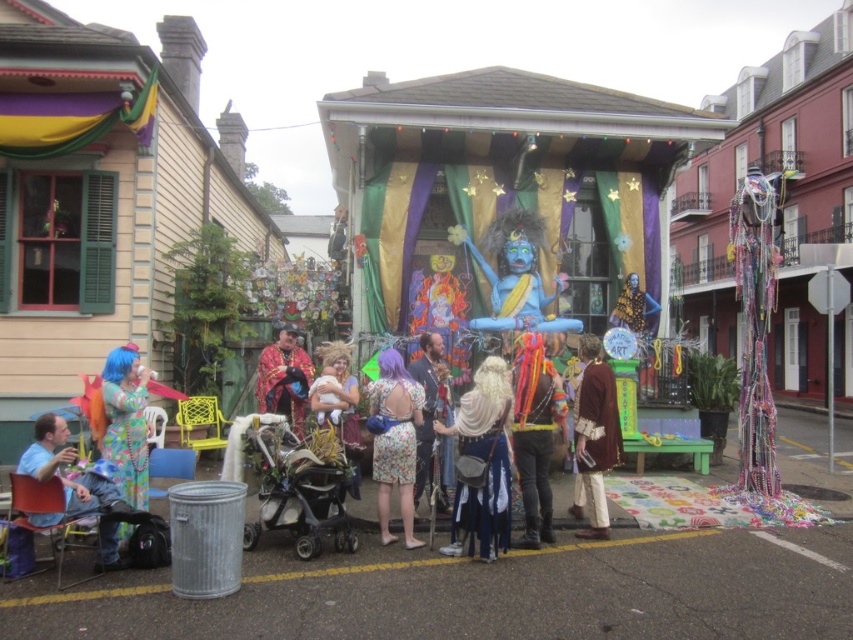
Is brown leather jacket at center wider than fluorescent blue wig at lower left?

Correct, the width of brown leather jacket at center exceeds that of fluorescent blue wig at lower left.

Looking at this image, which is more to the left, brown leather jacket at center or fluorescent blue wig at lower left?

fluorescent blue wig at lower left is more to the left.

Which is in front, point (581, 474) or point (128, 420)?

Point (128, 420) is more forward.

At what (x,y) coordinates should I click in order to perform the action: click on brown leather jacket at center. Please return your answer as a coordinate pair (x, y). This screenshot has width=853, height=640. Looking at the image, I should click on (595, 436).

Can you confirm if leather boots at center is positioned to the right of brown leather jacket at center?

Incorrect, leather boots at center is not on the right side of brown leather jacket at center.

Locate an element on the screen. The image size is (853, 640). leather boots at center is located at coordinates (535, 435).

Does point (532, 544) come closer to viewer compared to point (616, 400)?

Yes.

Locate an element on the screen. leather boots at center is located at coordinates (535, 435).

Can you confirm if blue velvet dress at center is positioned below fluorescent blue wig at lower left?

Correct, blue velvet dress at center is located below fluorescent blue wig at lower left.

Is point (482, 476) positioned in front of point (128, 374)?

Yes, it is.

I want to click on blue velvet dress at center, so click(x=482, y=465).

Find the location of `blue velvet dress at center`. blue velvet dress at center is located at coordinates (482, 465).